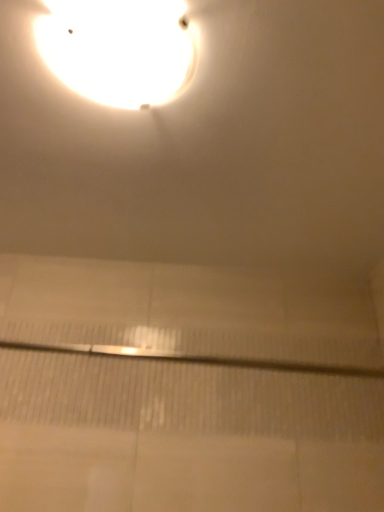
Measure the distance between point (114,67) and camera.

The distance of point (114,67) from camera is 37.44 inches.

What do you see at coordinates (119, 49) in the screenshot?
I see `white glossy light fixture at upper center` at bounding box center [119, 49].

I want to click on white glossy light fixture at upper center, so click(119, 49).

At what (x,y) coordinates should I click in order to perform the action: click on white glossy light fixture at upper center. Please return your answer as a coordinate pair (x, y). This screenshot has height=512, width=384. Looking at the image, I should click on (119, 49).